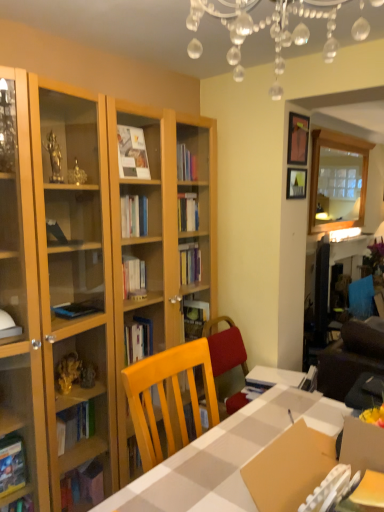
The height and width of the screenshot is (512, 384). Identify the location of white checkered table at center. (226, 456).

This screenshot has width=384, height=512. Describe the element at coordinates (337, 179) in the screenshot. I see `clear glass mirror at upper right` at that location.

What is the approximate height of wooden picture frame at upper right, placed as the first picture frame when sorted from bottom to top?

wooden picture frame at upper right, placed as the first picture frame when sorted from bottom to top, is 19.30 centimeters in height.

What are the coordinates of `matte black picture frame at upper right, which ranks as the second picture frame in bottom-to-top order` in the screenshot? It's located at (298, 139).

Considering the relative positions of clear crystal chandelier at upper center and matte black picture frame at upper right, marked as the first picture frame in a top-to-bottom arrangement, in the image provided, is clear crystal chandelier at upper center to the right of matte black picture frame at upper right, marked as the first picture frame in a top-to-bottom arrangement, from the viewer's perspective?

No, clear crystal chandelier at upper center is not to the right of matte black picture frame at upper right, marked as the first picture frame in a top-to-bottom arrangement.

From the image's perspective, is clear crystal chandelier at upper center positioned above or below matte black picture frame at upper right, marked as the first picture frame in a top-to-bottom arrangement?

From the image's perspective, clear crystal chandelier at upper center appears below matte black picture frame at upper right, marked as the first picture frame in a top-to-bottom arrangement.

Is clear crystal chandelier at upper center in contact with matte black picture frame at upper right, which ranks as the second picture frame in bottom-to-top order?

They are not placed beside each other.

Considering the sizes of matte black picture frame at upper right, marked as the first picture frame in a top-to-bottom arrangement, and clear glass mirror at upper right in the image, is matte black picture frame at upper right, marked as the first picture frame in a top-to-bottom arrangement, wider or thinner than clear glass mirror at upper right?

Clearly, matte black picture frame at upper right, marked as the first picture frame in a top-to-bottom arrangement, has less width compared to clear glass mirror at upper right.

The image size is (384, 512). I want to click on picture frame that is the 1st object located below the clear glass mirror at upper right (from the image's perspective), so click(298, 139).

Is matte black picture frame at upper right, marked as the first picture frame in a top-to-bottom arrangement, at the left side of clear glass mirror at upper right?

Yes.

From a real-world perspective, relative to clear glass mirror at upper right, is matte black picture frame at upper right, which ranks as the second picture frame in bottom-to-top order, vertically above or below?

matte black picture frame at upper right, which ranks as the second picture frame in bottom-to-top order, is situated higher than clear glass mirror at upper right in the real world.

Is wooden picture frame at upper right, placed as the first picture frame when sorted from bottom to top, oriented away from clear crystal chandelier at upper center?

wooden picture frame at upper right, placed as the first picture frame when sorted from bottom to top, does not have its back to clear crystal chandelier at upper center.

From a real-world perspective, is wooden picture frame at upper right, the 2th picture frame when ordered from top to bottom, on top of clear crystal chandelier at upper center?

No, from a real-world perspective, wooden picture frame at upper right, the 2th picture frame when ordered from top to bottom, is not over clear crystal chandelier at upper center

Which point is more distant from viewer, (293, 176) or (313, 0)?

Positioned behind is point (293, 176).

Looking at the image, does wooden picture frame at upper right, placed as the first picture frame when sorted from bottom to top, seem bigger or smaller compared to clear crystal chandelier at upper center?

Considering their sizes, wooden picture frame at upper right, placed as the first picture frame when sorted from bottom to top, takes up less space than clear crystal chandelier at upper center.

Considering the positions of objects clear glass mirror at upper right and matte black picture frame at upper right, marked as the first picture frame in a top-to-bottom arrangement, in the image provided, who is more to the left, clear glass mirror at upper right or matte black picture frame at upper right, marked as the first picture frame in a top-to-bottom arrangement,?

From the viewer's perspective, matte black picture frame at upper right, marked as the first picture frame in a top-to-bottom arrangement, appears more on the left side.

Can you confirm if clear glass mirror at upper right is wider than matte black picture frame at upper right, which ranks as the second picture frame in bottom-to-top order?

Correct, the width of clear glass mirror at upper right exceeds that of matte black picture frame at upper right, which ranks as the second picture frame in bottom-to-top order.

Which of these two, clear glass mirror at upper right or matte black picture frame at upper right, which ranks as the second picture frame in bottom-to-top order, stands shorter?

With less height is matte black picture frame at upper right, which ranks as the second picture frame in bottom-to-top order.

Find the location of `the 1st picture frame behind when counting from the white checkered table at center`. the 1st picture frame behind when counting from the white checkered table at center is located at coordinates (298, 139).

Does point (288, 136) come behind point (210, 502)?

Yes, it is behind point (210, 502).

Based on the photo, from a real-world perspective, is matte black picture frame at upper right, marked as the first picture frame in a top-to-bottom arrangement, positioned over white checkered table at center based on gravity?

Yes, from a real-world perspective, matte black picture frame at upper right, marked as the first picture frame in a top-to-bottom arrangement, is over white checkered table at center

Based on the photo, based on their sizes in the image, would you say white checkered table at center is bigger or smaller than clear crystal chandelier at upper center?

Clearly, white checkered table at center is smaller in size than clear crystal chandelier at upper center.

Is white checkered table at center positioned with its back to clear crystal chandelier at upper center?

white checkered table at center is not turned away from clear crystal chandelier at upper center.

Consider the image. Are white checkered table at center and clear crystal chandelier at upper center located far from each other?

Yes, white checkered table at center is far from clear crystal chandelier at upper center.

Is white checkered table at center not within clear crystal chandelier at upper center?

Yes, white checkered table at center is outside of clear crystal chandelier at upper center.

Would you say white checkered table at center is a long distance from wooden picture frame at upper right, placed as the first picture frame when sorted from bottom to top?

That's right, there is a large distance between white checkered table at center and wooden picture frame at upper right, placed as the first picture frame when sorted from bottom to top.

How distant is white checkered table at center from wooden picture frame at upper right, the 2th picture frame when ordered from top to bottom?

white checkered table at center and wooden picture frame at upper right, the 2th picture frame when ordered from top to bottom, are 4.93 feet apart.

Does white checkered table at center come behind wooden picture frame at upper right, the 2th picture frame when ordered from top to bottom?

No, white checkered table at center is in front of wooden picture frame at upper right, the 2th picture frame when ordered from top to bottom.

Locate an element on the screen. light fixture below the matte black picture frame at upper right, which ranks as the second picture frame in bottom-to-top order (from the image's perspective) is located at coordinates (270, 29).

The width and height of the screenshot is (384, 512). What are the coordinates of `glass door on the right of the matte black picture frame at upper right, which ranks as the second picture frame in bottom-to-top order` in the screenshot? It's located at [x=337, y=179].

Consider the image. Which object lies further to the anchor point clear glass mirror at upper right, matte black picture frame at upper right, marked as the first picture frame in a top-to-bottom arrangement, or wooden picture frame at upper right, the 2th picture frame when ordered from top to bottom?

matte black picture frame at upper right, marked as the first picture frame in a top-to-bottom arrangement, lies further to clear glass mirror at upper right than the other object.

Estimate the real-world distances between objects in this image. Which object is further from wooden picture frame at upper right, placed as the first picture frame when sorted from bottom to top, white checkered table at center or clear crystal chandelier at upper center?

Based on the image, white checkered table at center appears to be further to wooden picture frame at upper right, placed as the first picture frame when sorted from bottom to top.

Looking at the image, which one is located further to matte black picture frame at upper right, which ranks as the second picture frame in bottom-to-top order, clear glass mirror at upper right or white checkered table at center?

clear glass mirror at upper right.

When comparing their distances from white checkered table at center, does clear glass mirror at upper right or wooden picture frame at upper right, placed as the first picture frame when sorted from bottom to top, seem closer?

wooden picture frame at upper right, placed as the first picture frame when sorted from bottom to top, lies closer to white checkered table at center than the other object.

When comparing their distances from wooden picture frame at upper right, placed as the first picture frame when sorted from bottom to top, does clear glass mirror at upper right or matte black picture frame at upper right, marked as the first picture frame in a top-to-bottom arrangement, seem closer?

matte black picture frame at upper right, marked as the first picture frame in a top-to-bottom arrangement, is closer to wooden picture frame at upper right, placed as the first picture frame when sorted from bottom to top.

Considering their positions, is clear glass mirror at upper right positioned closer to clear crystal chandelier at upper center than white checkered table at center?

white checkered table at center is closer to clear crystal chandelier at upper center.

Which object lies further to the anchor point clear glass mirror at upper right, clear crystal chandelier at upper center or wooden picture frame at upper right, placed as the first picture frame when sorted from bottom to top?

clear crystal chandelier at upper center is further to clear glass mirror at upper right.

Looking at the image, which one is located further to clear crystal chandelier at upper center, matte black picture frame at upper right, marked as the first picture frame in a top-to-bottom arrangement, or white checkered table at center?

Based on the image, white checkered table at center appears to be further to clear crystal chandelier at upper center.

Where is `table between clear crystal chandelier at upper center and matte black picture frame at upper right, marked as the first picture frame in a top-to-bottom arrangement, along the z-axis`? Image resolution: width=384 pixels, height=512 pixels. table between clear crystal chandelier at upper center and matte black picture frame at upper right, marked as the first picture frame in a top-to-bottom arrangement, along the z-axis is located at coordinates (226, 456).

This screenshot has width=384, height=512. I want to click on picture frame between clear crystal chandelier at upper center and wooden picture frame at upper right, placed as the first picture frame when sorted from bottom to top, from front to back, so click(x=298, y=139).

I want to click on table between clear crystal chandelier at upper center and clear glass mirror at upper right in the front-back direction, so click(x=226, y=456).

This screenshot has width=384, height=512. Identify the location of picture frame between white checkered table at center and wooden picture frame at upper right, placed as the first picture frame when sorted from bottom to top, from front to back. coord(298,139).